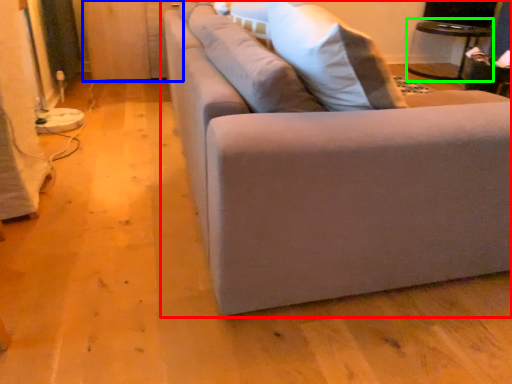
Question: Considering the real-world distances, which object is farthest from studio couch (highlighted by a red box)? dresser (highlighted by a blue box) or table (highlighted by a green box)?

Choices:
 (A) dresser
 (B) table

Answer: (B)